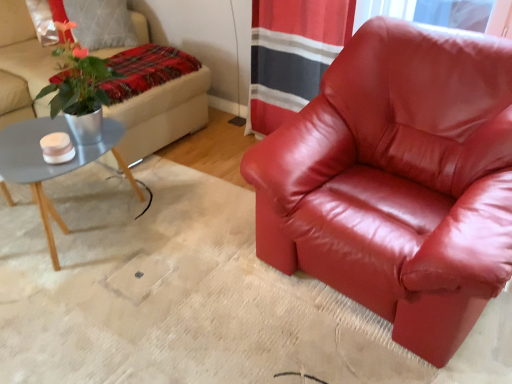
Find the location of `vacant space situated on the left part of satin red armchair at center`. vacant space situated on the left part of satin red armchair at center is located at coordinates [188, 261].